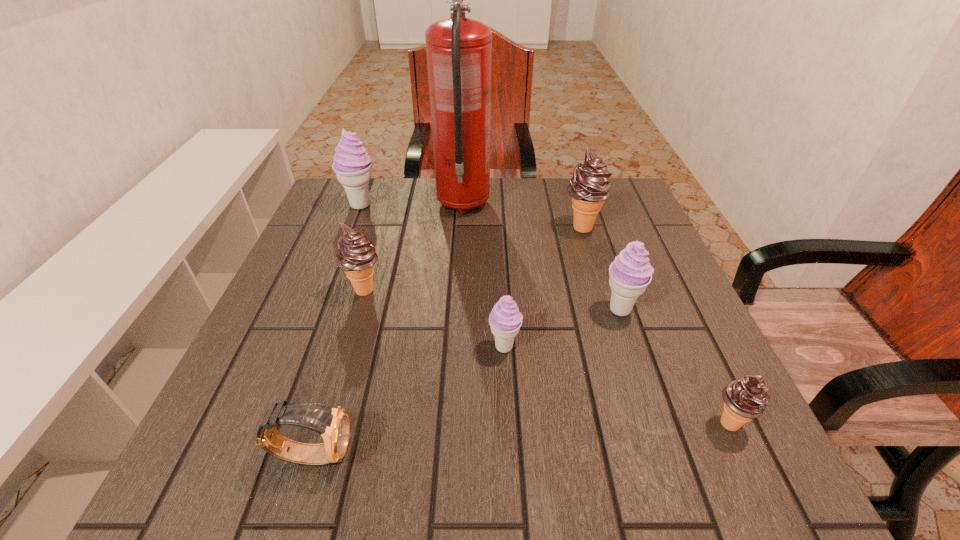
Image resolution: width=960 pixels, height=540 pixels. I want to click on the fifth farthest icecream, so click(505, 320).

Where is `the nearest purple icecream`? This screenshot has height=540, width=960. the nearest purple icecream is located at coordinates (505, 320).

The image size is (960, 540). In order to click on the nearest chocolate icecream in this screenshot , I will do click(x=745, y=399).

Locate an element on the screen. The image size is (960, 540). the rightmost object is located at coordinates (745, 399).

Where is `watch`? The width and height of the screenshot is (960, 540). watch is located at coordinates (333, 424).

Identify the location of vacant space located 0.200m on the back of the second chocolate icecream from right to left. The width and height of the screenshot is (960, 540). (567, 179).

The image size is (960, 540). What are the coordinates of `free space located on the front of the farthest purple icecream` in the screenshot? It's located at (335, 272).

What are the coordinates of `vacant space located 0.100m on the right of the second biggest chocolate icecream` in the screenshot? It's located at (430, 289).

Identify the location of vacant position located 0.080m on the front of the rightmost purple icecream. This screenshot has width=960, height=540. (636, 356).

The height and width of the screenshot is (540, 960). I want to click on blank area located on the back of the second purple icecream from left to right, so click(x=500, y=273).